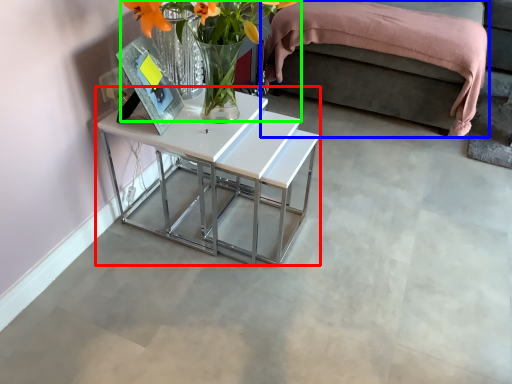
Question: Considering the real-world distances, which object is farthest from table (highlighted by a red box)? bed (highlighted by a blue box) or floral arrangement (highlighted by a green box)?

Choices:
 (A) bed
 (B) floral arrangement

Answer: (A)